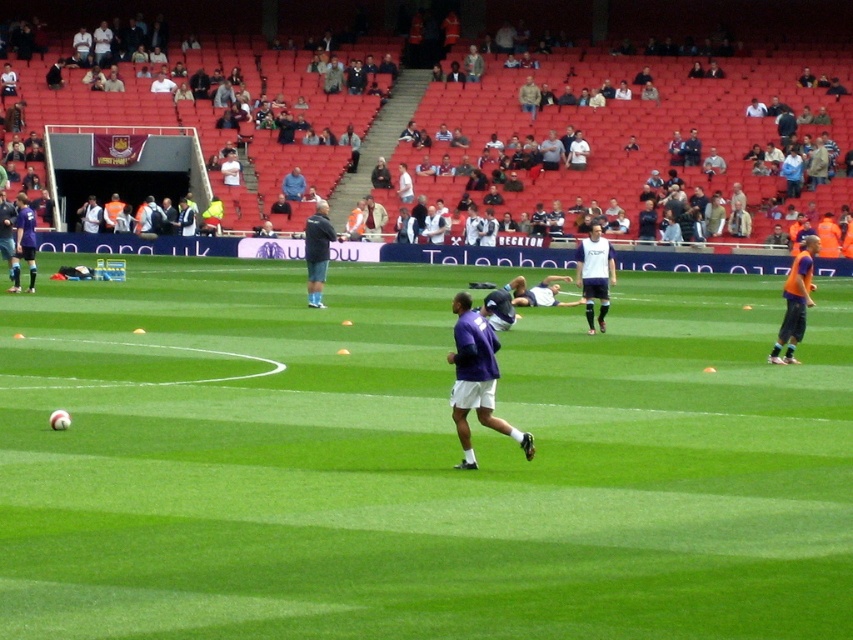
Question: Can you confirm if white matte jersey at center is positioned to the right of white jersey at center?

Choices:
 (A) no
 (B) yes

Answer: (B)

Question: Which object is farther from the camera taking this photo?

Choices:
 (A) white jersey at center
 (B) purple fabric jacket at center
 (C) purple matte soccer player at left

Answer: (C)

Question: Which of the following is the closest to the observer?

Choices:
 (A) white matte jersey at center
 (B) dark blue jacket at center
 (C) orange jersey at right

Answer: (C)

Question: Which point is farther to the camera?

Choices:
 (A) dark blue jacket at center
 (B) orange jersey at right
 (C) white matte jersey at center

Answer: (A)

Question: Does purple matte soccer player at left have a larger size compared to white jersey at center?

Choices:
 (A) no
 (B) yes

Answer: (B)

Question: Does white matte jersey at center have a lesser width compared to white jersey at center?

Choices:
 (A) no
 (B) yes

Answer: (A)